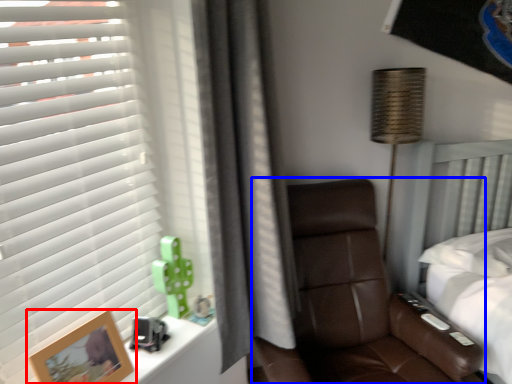
Question: Among these objects, which one is farthest to the camera, picture frame (highlighted by a red box) or chair (highlighted by a blue box)?

Choices:
 (A) picture frame
 (B) chair

Answer: (B)